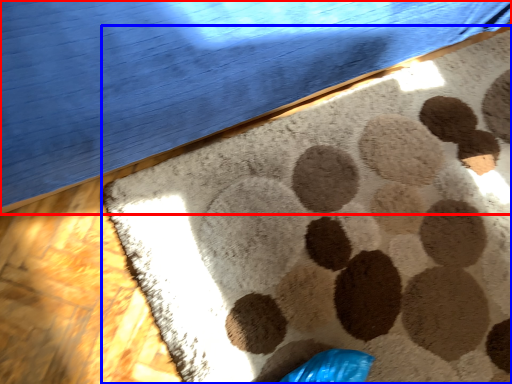
Question: Which of the following is the farthest to the observer, furniture (highlighted by a red box) or mat (highlighted by a blue box)?

Choices:
 (A) furniture
 (B) mat

Answer: (B)